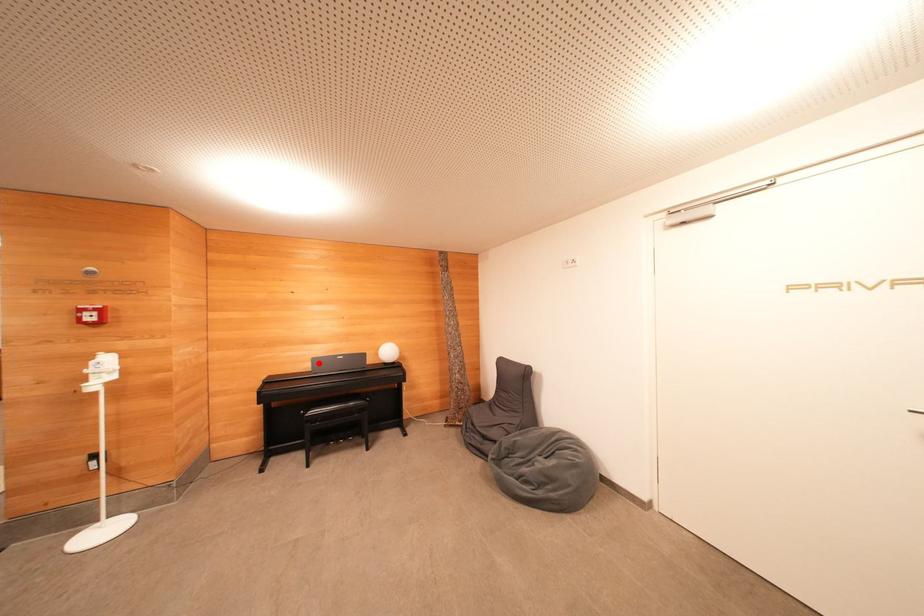
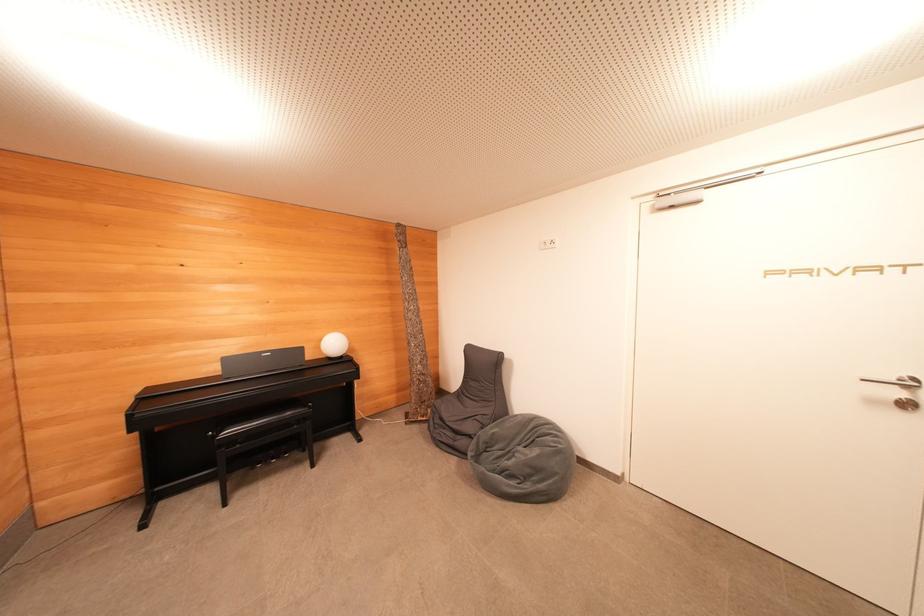
Where in the second image is the point corresponding to the highlighted location from the first image?

(229, 363)